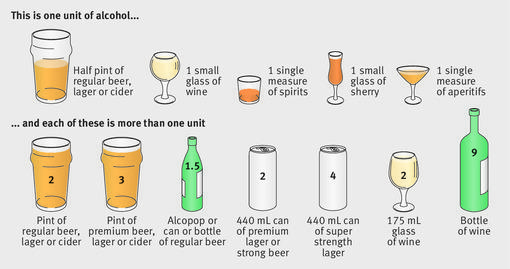
I want to click on 1 small glass of wine, so click(x=188, y=70), click(x=204, y=93).